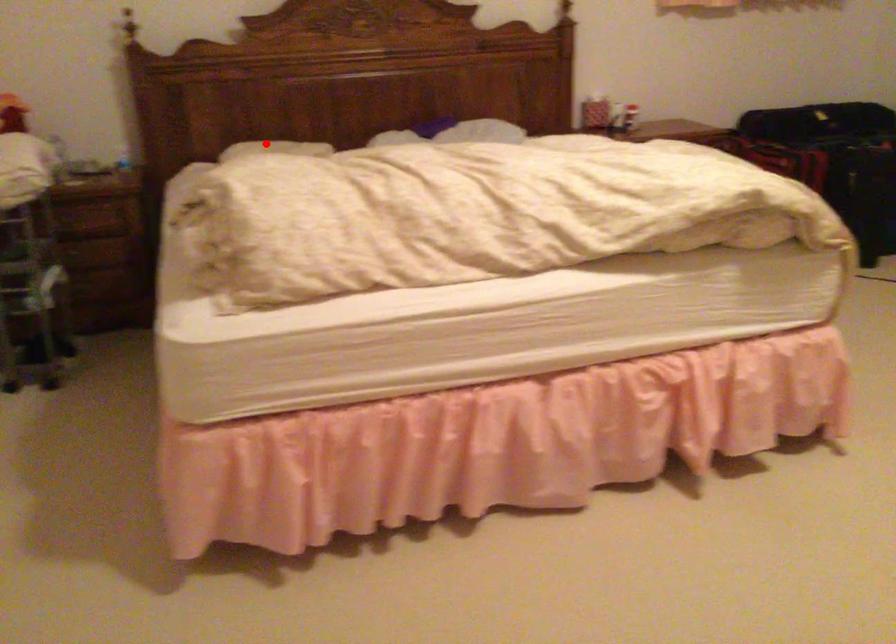
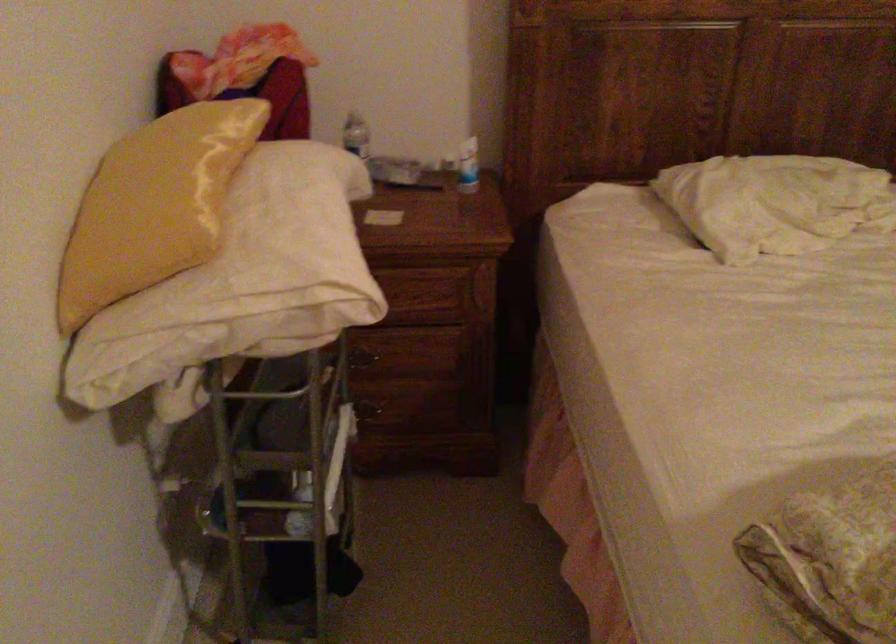
Question: I am providing you with two images of the same scene from different viewpoints. A red point is marked on the first image. Can you still see the location of the red point in image 2?

Choices:
 (A) Yes
 (B) No

Answer: (A)